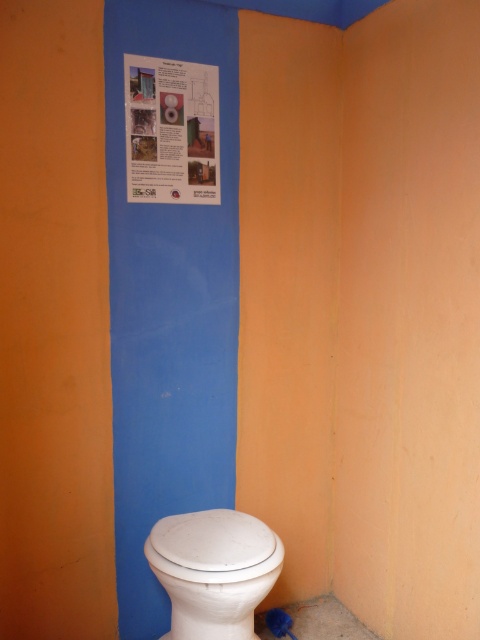
Question: Which of the following is the closest to the observer?

Choices:
 (A) white glossy toilet at lower right
 (B) matte paper poster at upper center

Answer: (A)

Question: Is white glossy toilet at lower right below matte paper poster at upper center?

Choices:
 (A) no
 (B) yes

Answer: (B)

Question: Is white glossy toilet at lower right to the right of matte paper poster at upper center from the viewer's perspective?

Choices:
 (A) yes
 (B) no

Answer: (A)

Question: Does white glossy toilet at lower right appear under matte paper poster at upper center?

Choices:
 (A) no
 (B) yes

Answer: (B)

Question: Which object is farther from the camera taking this photo?

Choices:
 (A) white glossy toilet at lower right
 (B) matte paper poster at upper center

Answer: (B)